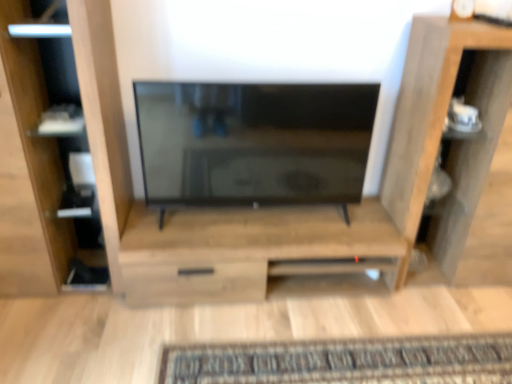
Question: Could wooden shelf at right be considered to be inside matte wood shelf at left?

Choices:
 (A) no
 (B) yes

Answer: (A)

Question: Is matte wood shelf at left at the right side of wooden shelf at right?

Choices:
 (A) yes
 (B) no

Answer: (B)

Question: Is matte wood shelf at left smaller than wooden shelf at right?

Choices:
 (A) yes
 (B) no

Answer: (A)

Question: Considering the relative sizes of matte wood shelf at left and wooden shelf at right in the image provided, is matte wood shelf at left taller than wooden shelf at right?

Choices:
 (A) yes
 (B) no

Answer: (A)

Question: Would you say matte wood shelf at left is outside wooden shelf at right?

Choices:
 (A) no
 (B) yes

Answer: (B)

Question: Is there a large distance between matte wood shelf at left and wooden shelf at right?

Choices:
 (A) no
 (B) yes

Answer: (B)

Question: Considering the relative sizes of matte wood shelf at left and matte black tv at center in the image provided, is matte wood shelf at left wider than matte black tv at center?

Choices:
 (A) yes
 (B) no

Answer: (A)

Question: Does matte wood shelf at left have a lesser height compared to matte black tv at center?

Choices:
 (A) no
 (B) yes

Answer: (A)

Question: Is matte wood shelf at left not close to matte black tv at center?

Choices:
 (A) no
 (B) yes

Answer: (A)

Question: Is matte wood shelf at left located outside matte black tv at center?

Choices:
 (A) yes
 (B) no

Answer: (A)

Question: Is matte wood shelf at left taller than matte black tv at center?

Choices:
 (A) yes
 (B) no

Answer: (A)

Question: Is matte wood shelf at left behind matte black tv at center?

Choices:
 (A) yes
 (B) no

Answer: (B)

Question: Is matte black tv at center positioned before wooden cabinet at center?

Choices:
 (A) yes
 (B) no

Answer: (A)